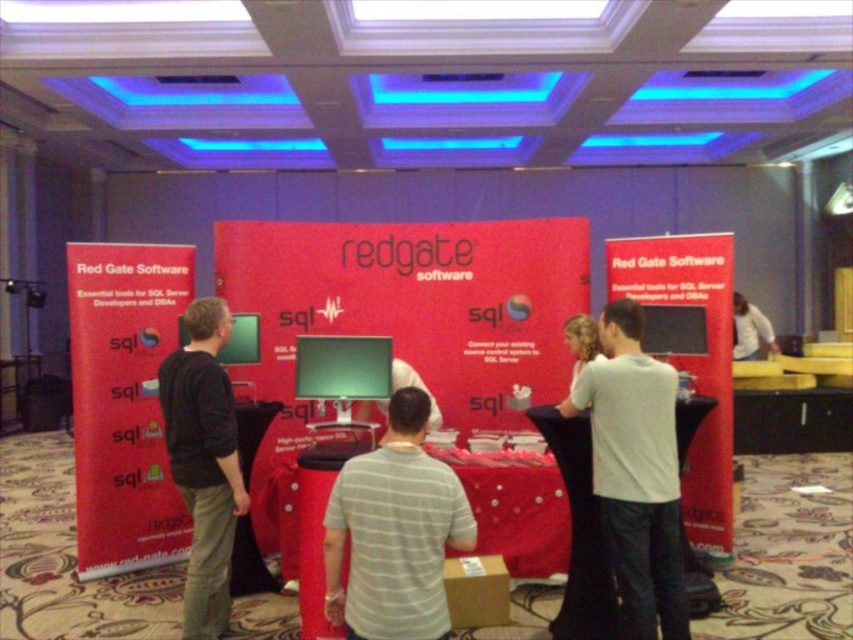
Question: Does white cotton shirt at center have a smaller size compared to white fabric at center?

Choices:
 (A) yes
 (B) no

Answer: (A)

Question: Is gray striped shirt at center closer to camera compared to black cotton shirt at left?

Choices:
 (A) no
 (B) yes

Answer: (B)

Question: Is gray striped shirt at center bigger than black cotton shirt at left?

Choices:
 (A) yes
 (B) no

Answer: (B)

Question: Which of the following is the farthest from the observer?

Choices:
 (A) (738, 332)
 (B) (459, 541)
 (C) (648, 588)
 (D) (167, 369)

Answer: (A)

Question: Among these points, which one is farthest from the camera?

Choices:
 (A) click(x=221, y=632)
 (B) click(x=326, y=536)

Answer: (A)

Question: Which point appears farthest from the camera in this image?

Choices:
 (A) (618, 515)
 (B) (746, 317)
 (C) (186, 456)

Answer: (B)